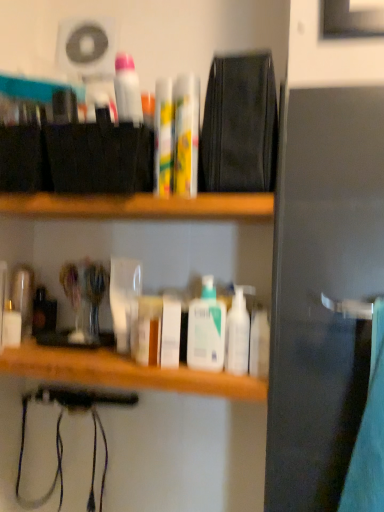
Question: Does point (173, 296) appear closer or farther from the camera than point (160, 92)?

Choices:
 (A) farther
 (B) closer

Answer: (A)

Question: In terms of width, does white glossy lotion at center, acting as the fifth toiletry starting from the right, look wider or thinner when compared to yellow-green plastic tubes at center, the 5th toiletry positioned from the left?

Choices:
 (A) thin
 (B) wide

Answer: (B)

Question: Estimate the real-world distances between objects in this image. Which object is closer to the white glossy lotion at center, which appears as the 10th toiletry when viewed from the left?

Choices:
 (A) translucent plastic jar at center, arranged as the fourth toiletry when viewed from the left
 (B) white glossy lotion at center, acting as the fifth toiletry starting from the right
 (C) wooden shelf at center
 (D) yellow-green plastic tubes at center, the 5th toiletry positioned from the left
 (E) white glossy bottles at center

Answer: (B)

Question: Estimate the real-world distances between objects in this image. Which object is farther from the white glossy lotion at center, the 3th toiletry positioned from the right?

Choices:
 (A) white glossy toothpaste at upper center
 (B) wooden shelf at center
 (C) clear glass jar at center, placed as the 3th toiletry when sorted from left to right
 (D) white glossy lotion at center, which appears as the 10th toiletry when viewed from the left
 (E) white glossy lotion at center, acting as the fifth toiletry starting from the right

Answer: (A)